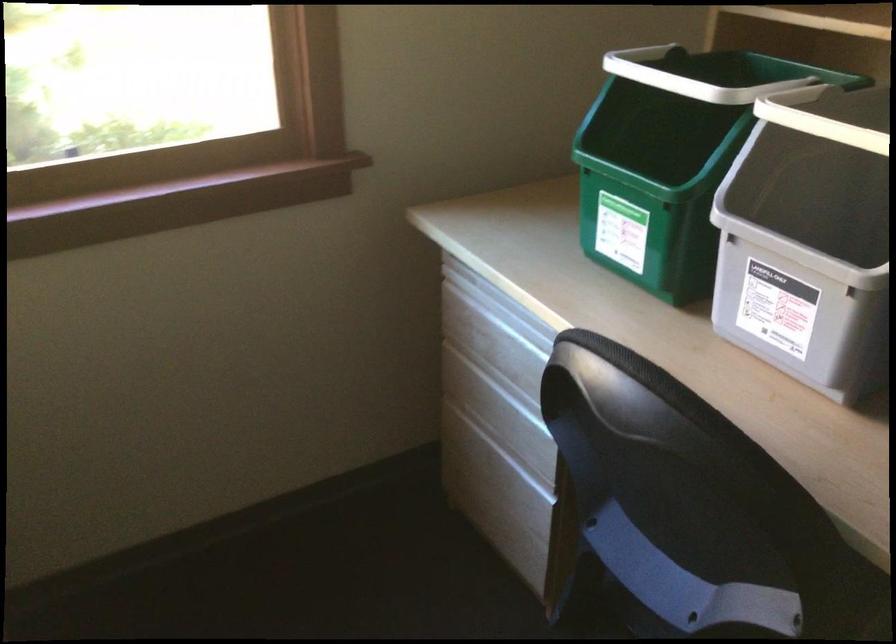
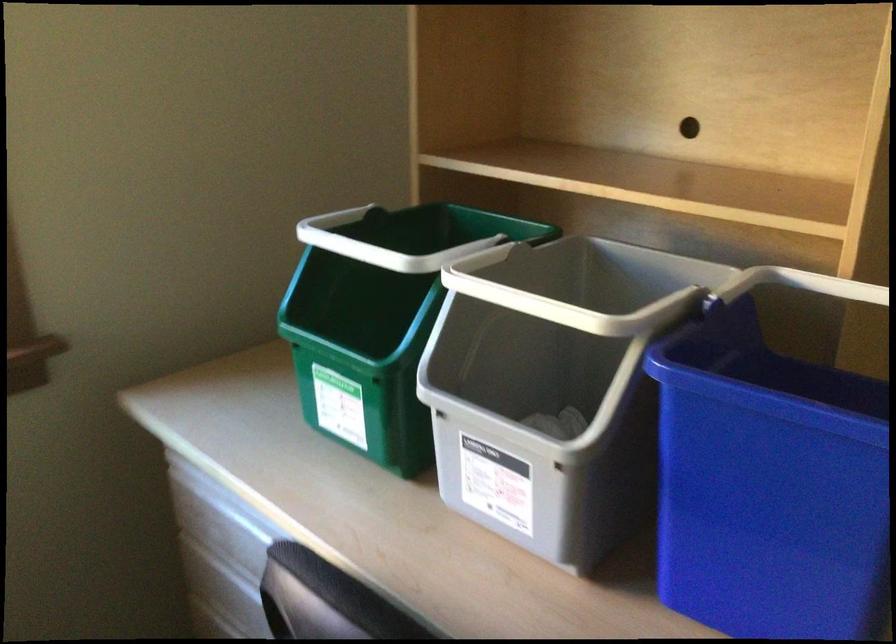
Which direction would the cameraman need to move to produce the second image?

The cameraman walked toward right, forward.